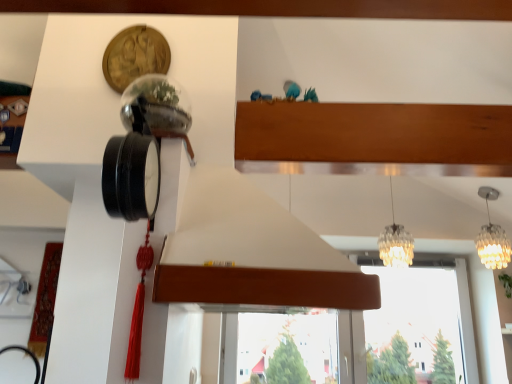
Question: From the image's perspective, is translucent glass chandelier at center, the 1th lamp in the left-to-right sequence, beneath translucent glass chandelier at upper right, the 1th lamp in the right-to-left sequence?

Choices:
 (A) yes
 (B) no

Answer: (B)

Question: Can you confirm if translucent glass chandelier at center, the 1th lamp in the left-to-right sequence, is thinner than translucent glass chandelier at upper right, the 1th lamp in the right-to-left sequence?

Choices:
 (A) no
 (B) yes

Answer: (B)

Question: From the image's perspective, is translucent glass chandelier at center, the 1th lamp in the left-to-right sequence, above translucent glass chandelier at upper right, the 1th lamp in the right-to-left sequence?

Choices:
 (A) yes
 (B) no

Answer: (A)

Question: Is translucent glass chandelier at center, placed as the second lamp when sorted from right to left, facing towards translucent glass chandelier at upper right, the 1th lamp in the right-to-left sequence?

Choices:
 (A) yes
 (B) no

Answer: (B)

Question: From a real-world perspective, is translucent glass chandelier at center, the 1th lamp in the left-to-right sequence, under translucent glass chandelier at upper right, the 2th lamp when ordered from left to right?

Choices:
 (A) no
 (B) yes

Answer: (A)

Question: From a real-world perspective, is translucent glass chandelier at upper right, the 2th lamp when ordered from left to right, positioned above or below transparent glass window at center?

Choices:
 (A) above
 (B) below

Answer: (A)

Question: Is translucent glass chandelier at upper right, the 2th lamp when ordered from left to right, in front of or behind transparent glass window at center in the image?

Choices:
 (A) behind
 (B) front

Answer: (B)

Question: From the image's perspective, is translucent glass chandelier at upper right, the 1th lamp in the right-to-left sequence, located above or below transparent glass window at center?

Choices:
 (A) below
 (B) above

Answer: (B)

Question: Does point (504, 258) appear closer or farther from the camera than point (186, 349)?

Choices:
 (A) closer
 (B) farther

Answer: (B)

Question: From a real-world perspective, is transparent glass window at center physically located above or below wooden at upper center?

Choices:
 (A) below
 (B) above

Answer: (A)

Question: Is transparent glass window at center to the left or to the right of wooden at upper center in the image?

Choices:
 (A) right
 (B) left

Answer: (A)

Question: Which is correct: transparent glass window at center is inside wooden at upper center, or outside of it?

Choices:
 (A) outside
 (B) inside

Answer: (A)

Question: Is transparent glass window at center in front of or behind wooden at upper center in the image?

Choices:
 (A) front
 (B) behind

Answer: (B)

Question: Considering their positions, is wooden at upper center located in front of or behind translucent glass chandelier at center, placed as the second lamp when sorted from right to left?

Choices:
 (A) behind
 (B) front

Answer: (B)

Question: From the image's perspective, relative to translucent glass chandelier at center, placed as the second lamp when sorted from right to left, is wooden at upper center above or below?

Choices:
 (A) above
 (B) below

Answer: (A)